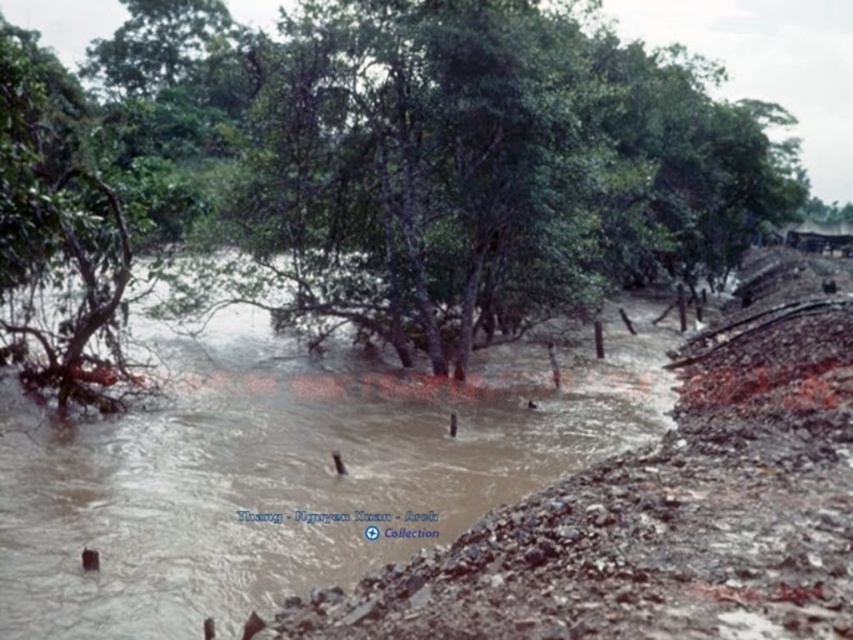
In the scene shown: You are standing at the point marked by the coordinates point (x=376, y=170) in the flooded area. Looking around, you see the green matte tree at center. Which direction should you move to reach the rocky embankment on the right side of the image?

The rocky embankment on the right side of the image is located to the right of the green matte tree at center. Since you are at point (x=376, y=170), which represents the green matte tree at center, you should move to the right to reach the rocky embankment on the right side of the image.

You are a hiker trying to cross the flooded area. You see the green matte tree at center and the brown muddy water at center. Which object is positioned to the right of the other?

The green matte tree at center is to the right of brown muddy water at center.

You are a hiker trying to cross the flooded area. You see the green matte tree at center and the brown muddy water at center. Which one is wider in width?

The green matte tree at center might be wider than brown muddy water at center.